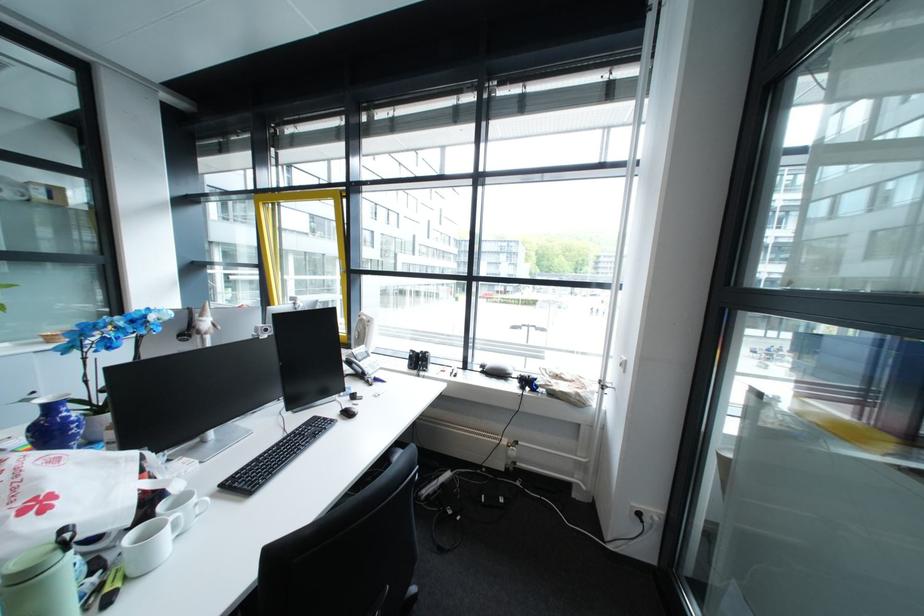
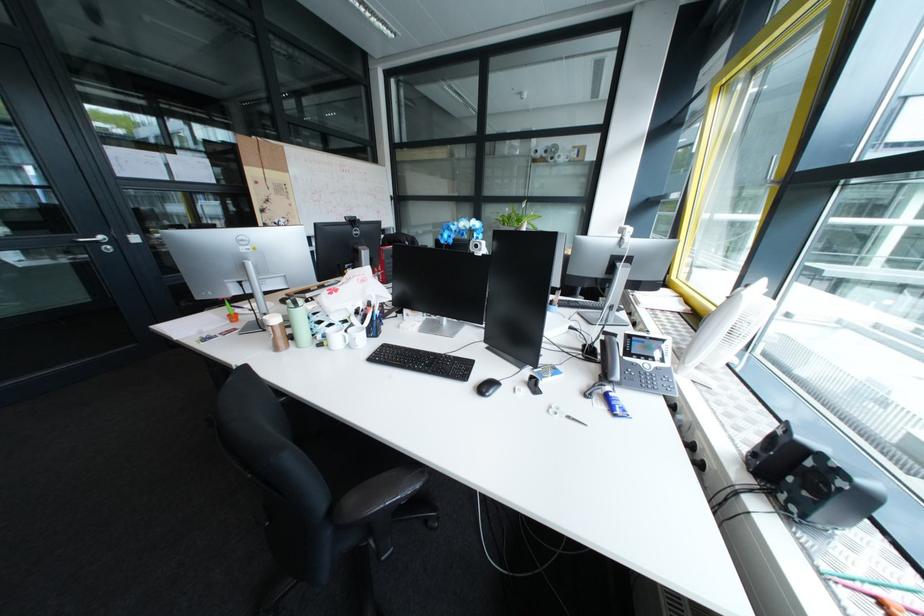
In the second image, find the point that corresponds to (434,355) in the first image.

(823, 464)